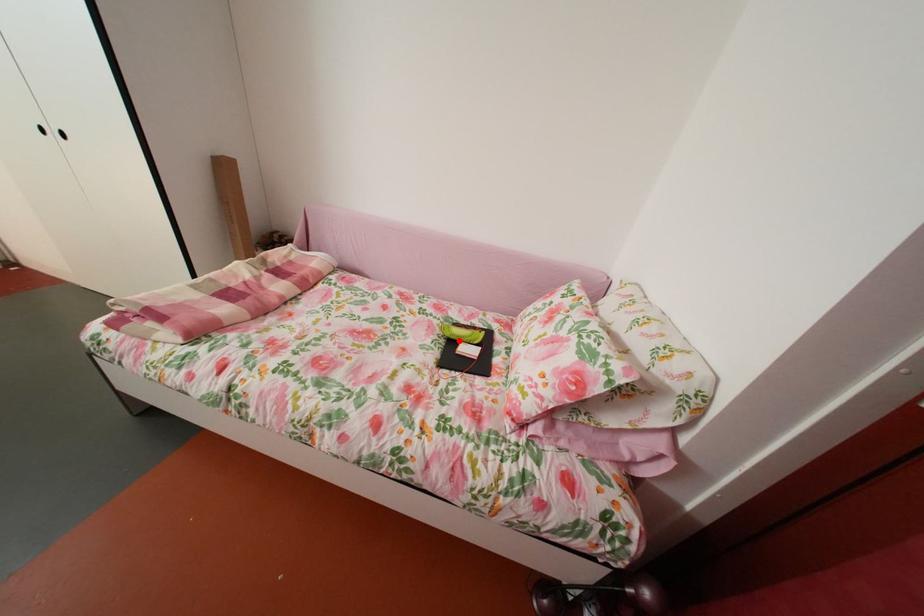
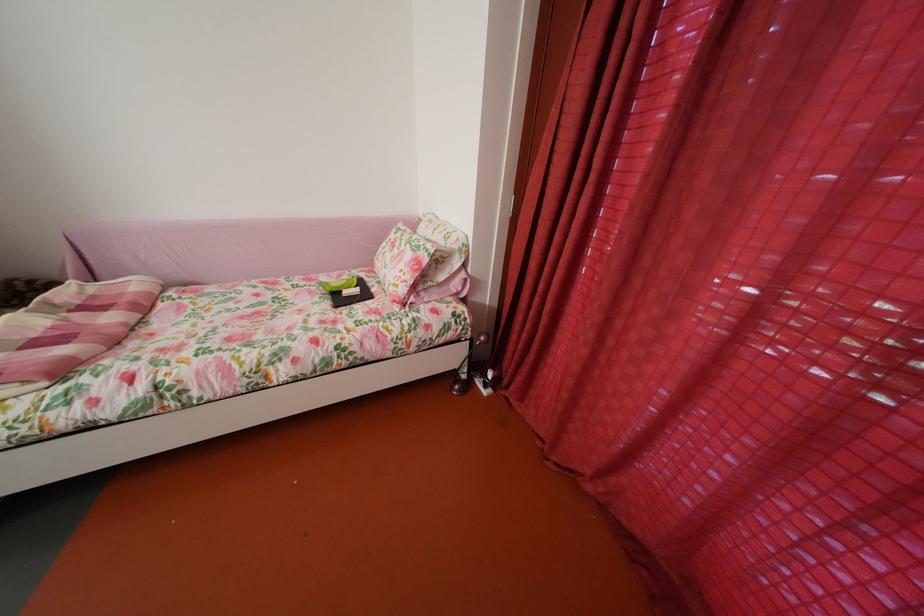
Where in the second image is the point corresponding to the highlighted location from the first image?

(341, 296)